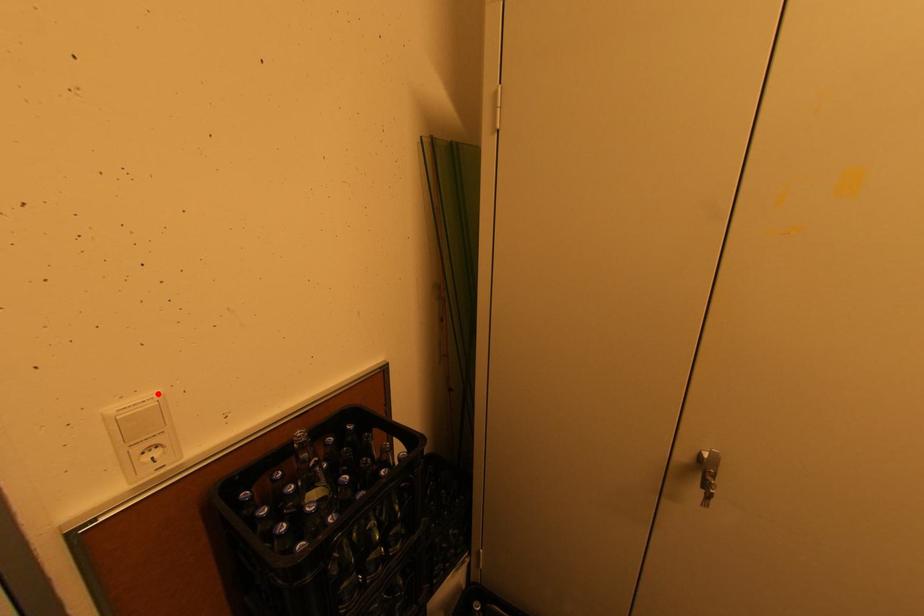
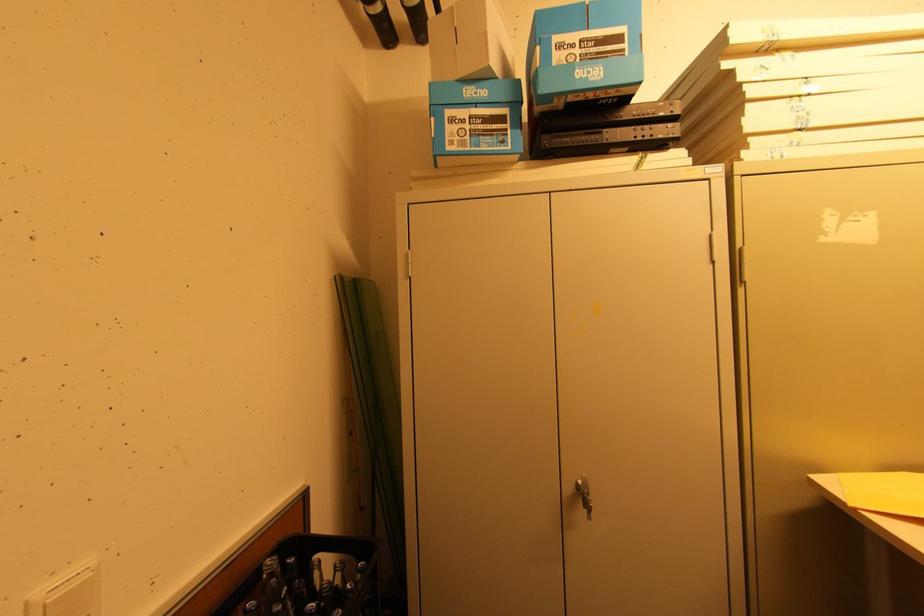
In the second image, find the point that corresponds to the highlighted location in the first image.

(91, 562)